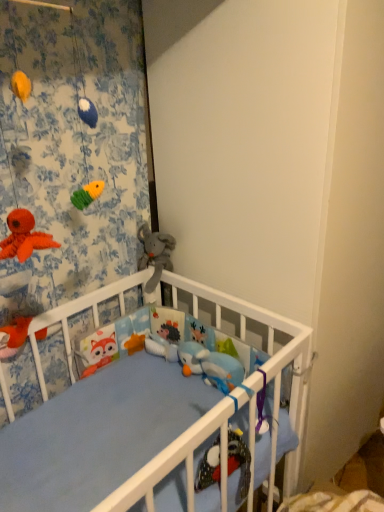
Question: In terms of height, does floral fabric curtain at upper left look taller or shorter compared to matte orange plush toy at lower left, the first toy from the front?

Choices:
 (A) short
 (B) tall

Answer: (B)

Question: Is floral fabric curtain at upper left inside or outside of matte orange plush toy at lower left, which appears as the second toy when viewed from the right?

Choices:
 (A) inside
 (B) outside

Answer: (B)

Question: Estimate the real-world distances between objects in this image. Which object is farther from the soft gray plush elephant at center, which is counted as the 2th toy, starting from the left?

Choices:
 (A) matte orange plush toy at lower left, which is the first toy in bottom-to-top order
 (B) floral fabric curtain at upper left

Answer: (A)

Question: Which object is the farthest from the soft gray plush elephant at center, which is counted as the 2th toy, starting from the left?

Choices:
 (A) floral fabric curtain at upper left
 (B) matte orange plush toy at lower left, which is the first toy in left-to-right order

Answer: (B)